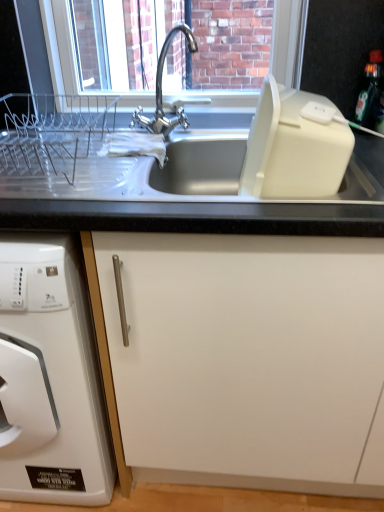
Question: Are white matte cabinet at center and white plastic dish rack at left beside each other?

Choices:
 (A) yes
 (B) no

Answer: (B)

Question: Can you confirm if white matte cabinet at center is wider than white plastic dish rack at left?

Choices:
 (A) yes
 (B) no

Answer: (B)

Question: From a real-world perspective, is white matte cabinet at center positioned over white plastic dish rack at left based on gravity?

Choices:
 (A) yes
 (B) no

Answer: (A)

Question: Does white matte cabinet at center appear on the right side of white plastic dish rack at left?

Choices:
 (A) no
 (B) yes

Answer: (B)

Question: Is white matte cabinet at center outside of white plastic dish rack at left?

Choices:
 (A) no
 (B) yes

Answer: (B)

Question: Is white matte cabinet at center thinner than white plastic dish rack at left?

Choices:
 (A) no
 (B) yes

Answer: (B)

Question: Considering the relative positions of clear glass window screen at upper center and white matte cabinet at center in the image provided, is clear glass window screen at upper center behind white matte cabinet at center?

Choices:
 (A) no
 (B) yes

Answer: (B)

Question: Is clear glass window screen at upper center looking in the opposite direction of white matte cabinet at center?

Choices:
 (A) yes
 (B) no

Answer: (B)

Question: Does clear glass window screen at upper center have a larger size compared to white matte cabinet at center?

Choices:
 (A) yes
 (B) no

Answer: (B)

Question: Could you tell me if clear glass window screen at upper center is turned towards white matte cabinet at center?

Choices:
 (A) no
 (B) yes

Answer: (A)

Question: From a real-world perspective, is clear glass window screen at upper center physically above white matte cabinet at center?

Choices:
 (A) no
 (B) yes

Answer: (B)

Question: Is clear glass window screen at upper center at the right side of white matte cabinet at center?

Choices:
 (A) yes
 (B) no

Answer: (B)

Question: Is black glossy bottle at upper right thinner than white plastic dish rack at left?

Choices:
 (A) yes
 (B) no

Answer: (A)